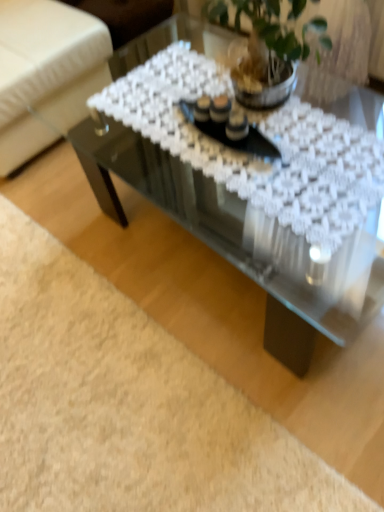
This screenshot has height=512, width=384. I want to click on vacant area that is in front of clear glass plate at center, so click(268, 181).